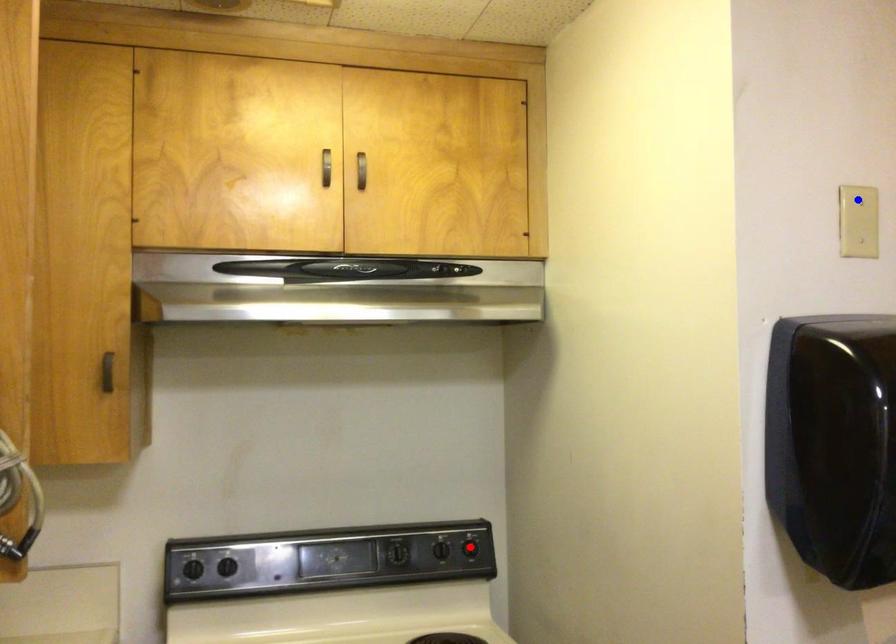
Question: Two points are marked on the image. Which point is closer to the camera?

Choices:
 (A) Blue point is closer.
 (B) Red point is closer.

Answer: (A)